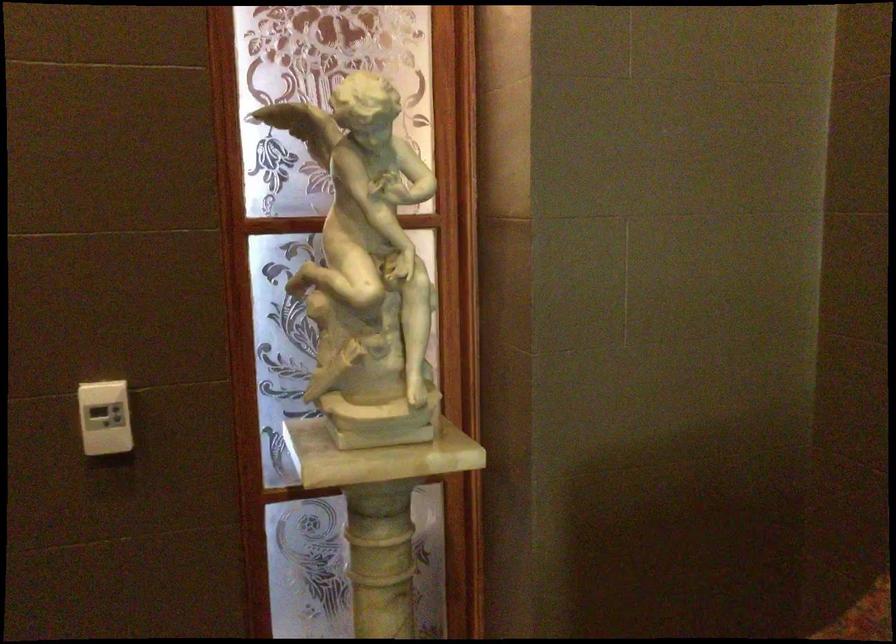
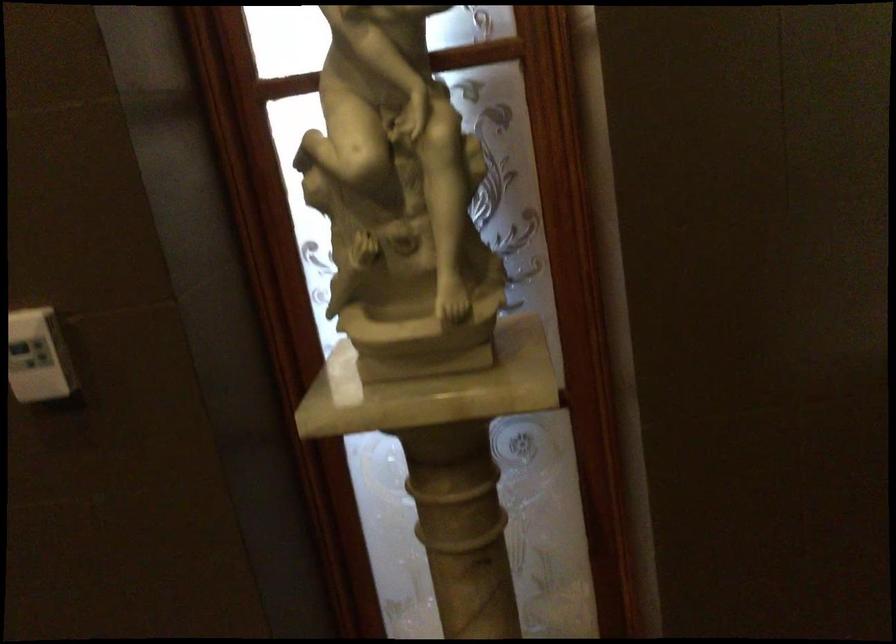
Question: Based on the continuous images, in which direction is the camera rotating? Reply with the corresponding letter.

Choices:
 (A) Left
 (B) Right
 (C) Up
 (D) Down

Answer: (A)